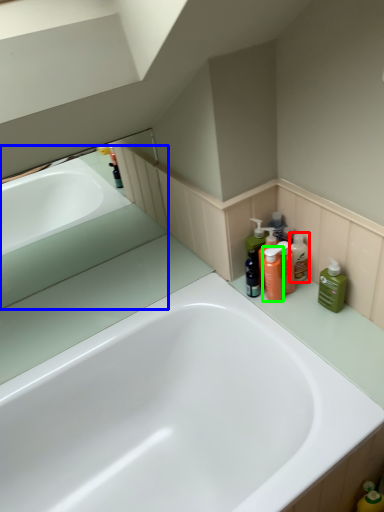
Question: Which is farther away from mouthwash (highlighted by a red box)? bath (highlighted by a blue box) or cleaning product (highlighted by a green box)?

Choices:
 (A) bath
 (B) cleaning product

Answer: (A)